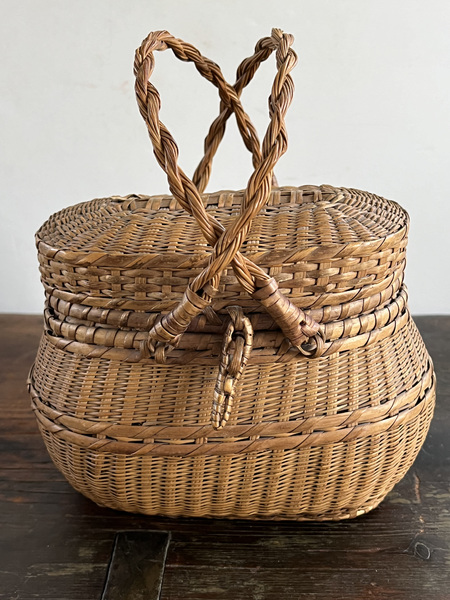
Locate an element on the screen. connection of handle to wicker basket sides is located at coordinates pos(159,352), pos(315,343).